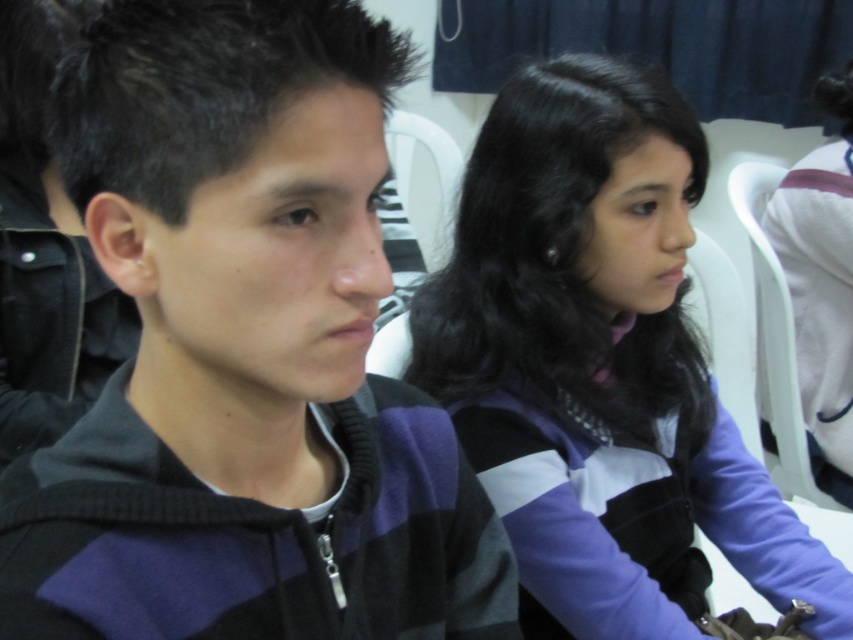
Question: In this image, where is black striped sweater at center located relative to purple striped sweater at center?

Choices:
 (A) left
 (B) right

Answer: (A)

Question: Which of the following is the closest to the observer?

Choices:
 (A) purple striped sweater at center
 (B) black striped sweater at center

Answer: (B)

Question: Which point appears closest to the camera in this image?

Choices:
 (A) (137, 401)
 (B) (643, 520)

Answer: (A)

Question: Is black striped sweater at center below purple striped sweater at center?

Choices:
 (A) no
 (B) yes

Answer: (B)

Question: Where is black striped sweater at center located in relation to purple striped sweater at center in the image?

Choices:
 (A) left
 (B) right

Answer: (A)

Question: Which object is farther from the camera taking this photo?

Choices:
 (A) purple striped sweater at center
 (B) black striped sweater at center

Answer: (A)